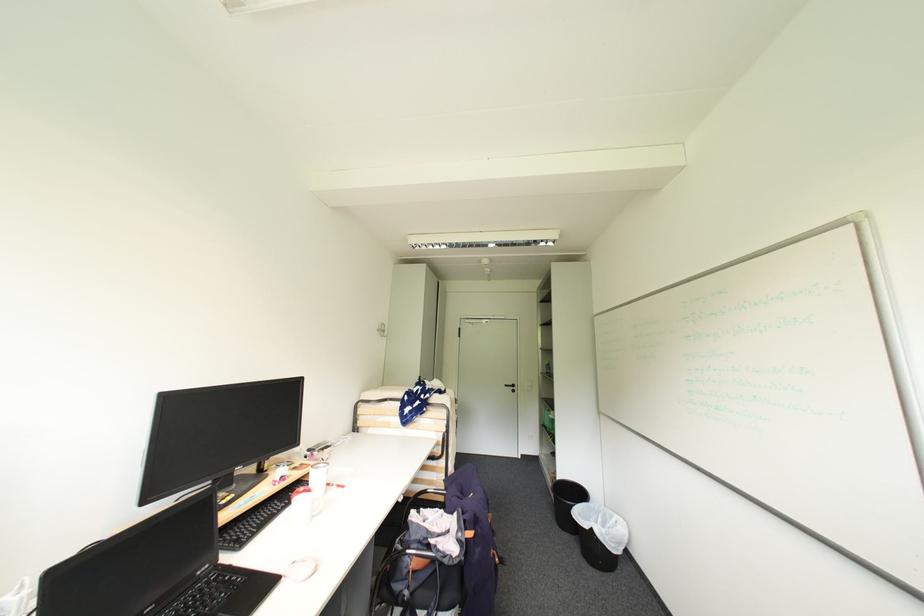
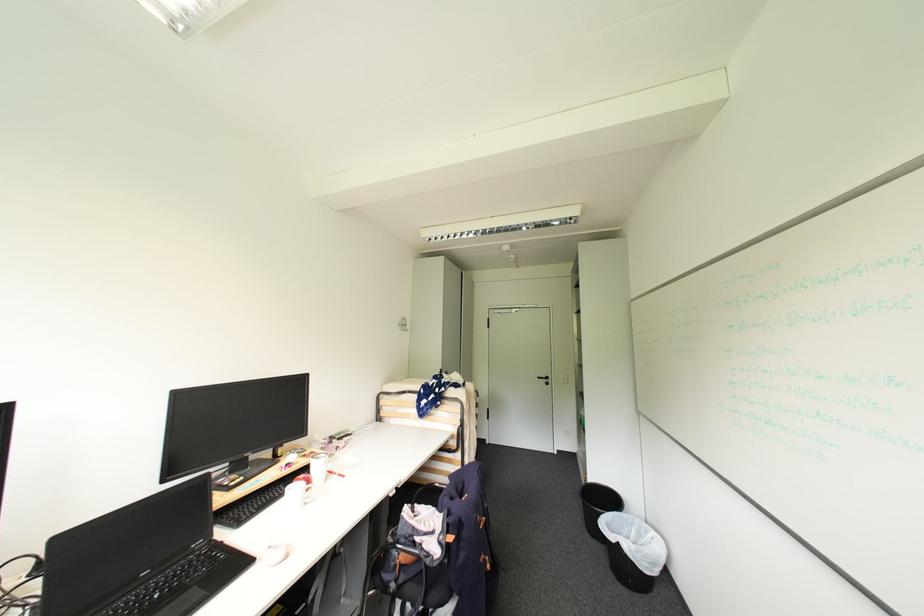
Where in the second image is the point corresponding to pixel 285 511 from the first image?

(286, 495)